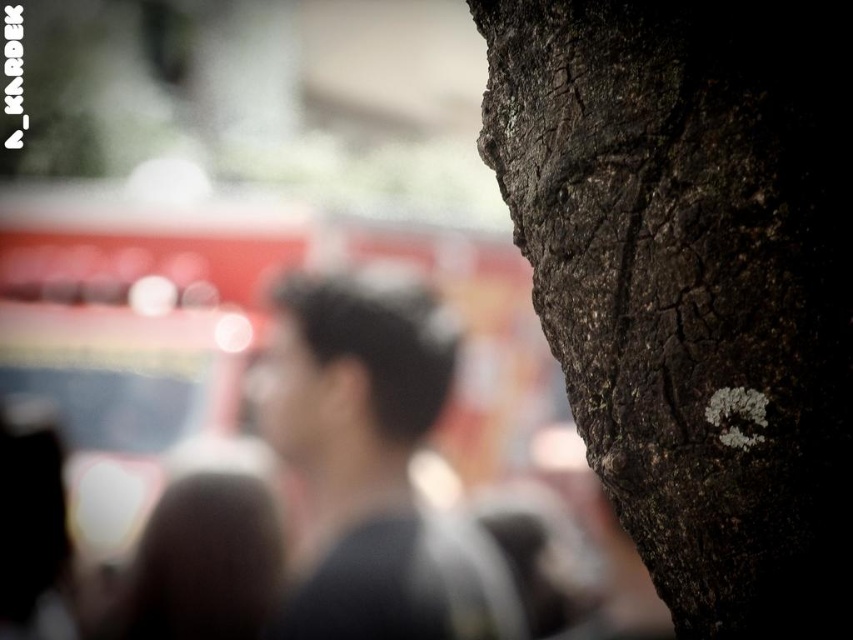
You are an artist sketching this scene. You need to decide which object to draw first based on their thickness. According to the image, which is thinner, the dark brown rough bark at center or the dark gray hair at center?

The dark brown rough bark at center is thinner than the dark gray hair at center.

You are standing in front of a tree trunk and want to touch the dark brown rough bark at center. Where should you reach to find it?

The dark brown rough bark at center is located at the coordinates point (695, 282), so you should reach towards that point to touch it.

From the picture: You are standing in front of the tree trunk on the right side. You want to touch the dark brown rough bark at center. If you move your hand towards the point marked as point (695,282), will you be able to reach the bark?

Yes, the point (695,282) marks the dark brown rough bark at center, so moving your hand towards that point will allow you to reach the bark.